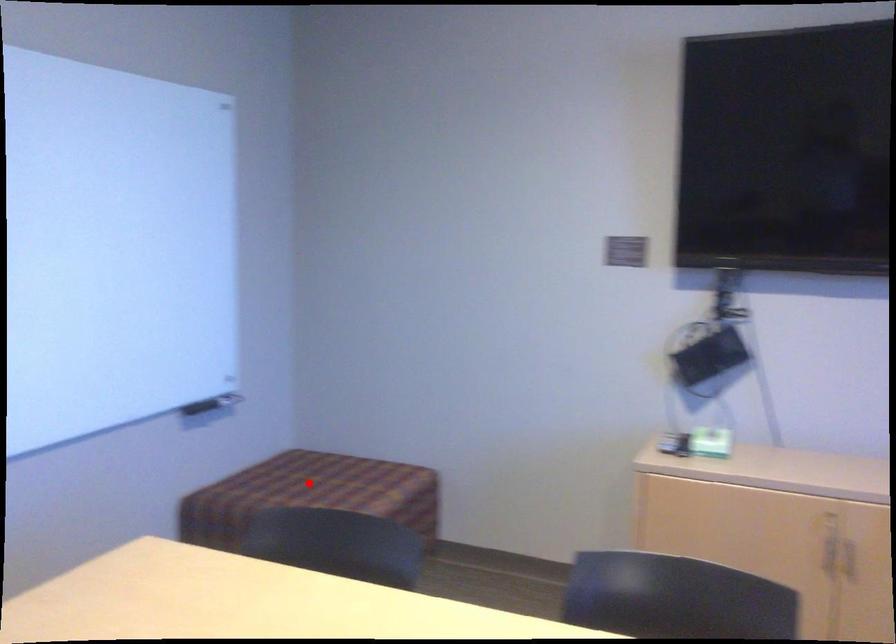
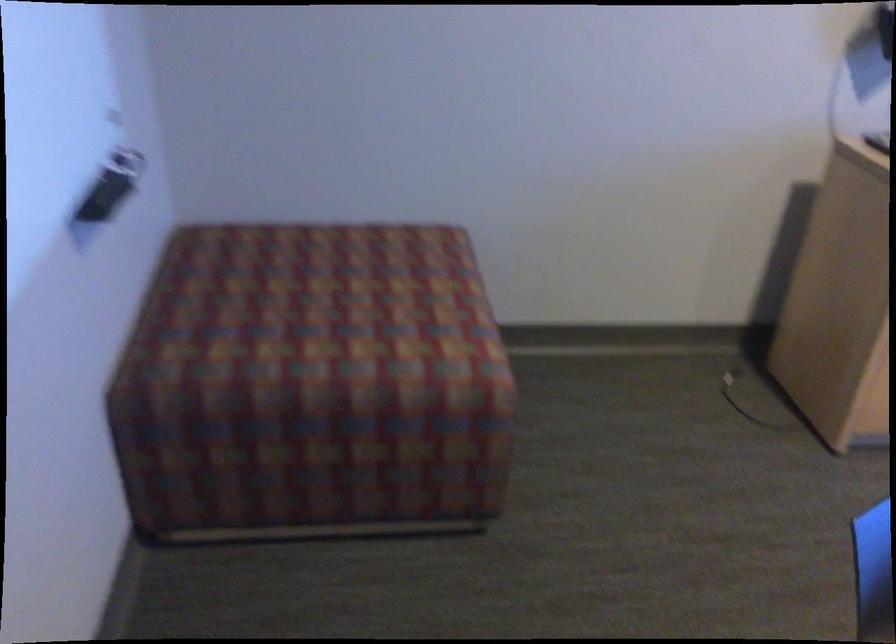
Question: I am providing you with two images of the same scene from different viewpoints. A red point is marked on the first image. Is the red point's position out of view in image 2?

Choices:
 (A) Yes
 (B) No

Answer: (B)